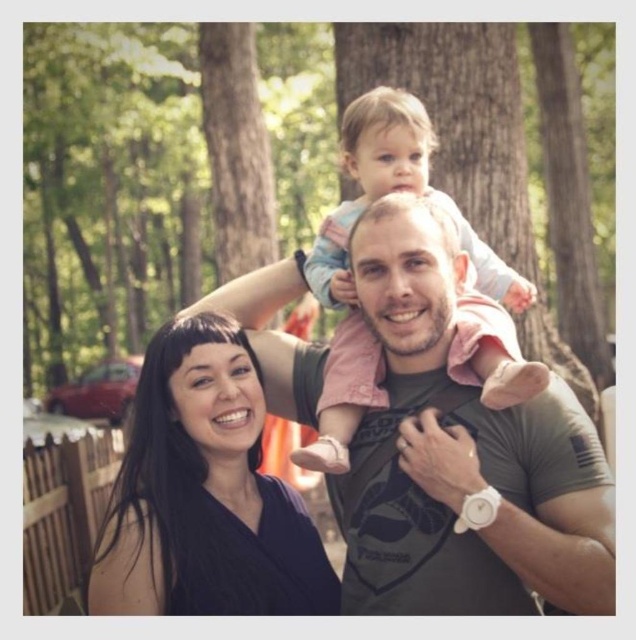
You are a photographer standing 10 feet away from the scene. You want to take a photo of the matte gray shirt at center and the black matte hair at center so that both are clearly visible in the frame. Given that your camera has a minimum focus distance of 5 feet, will you be able to capture both subjects in focus without moving closer?

The distance between the matte gray shirt at center and black matte hair at center is 4.36 feet. Since the camera requires a minimum focus distance of 5 feet to keep both subjects in focus, and you are currently 10 feet away, which is beyond the minimum requirement, you can capture both subjects in focus without moving closer.

You are a photographer taking a picture of the black matte hair at center and the light pink fabric at center. Which object is closer to the camera?

The black matte hair at center is closer to the camera since the light pink fabric at center is behind it.